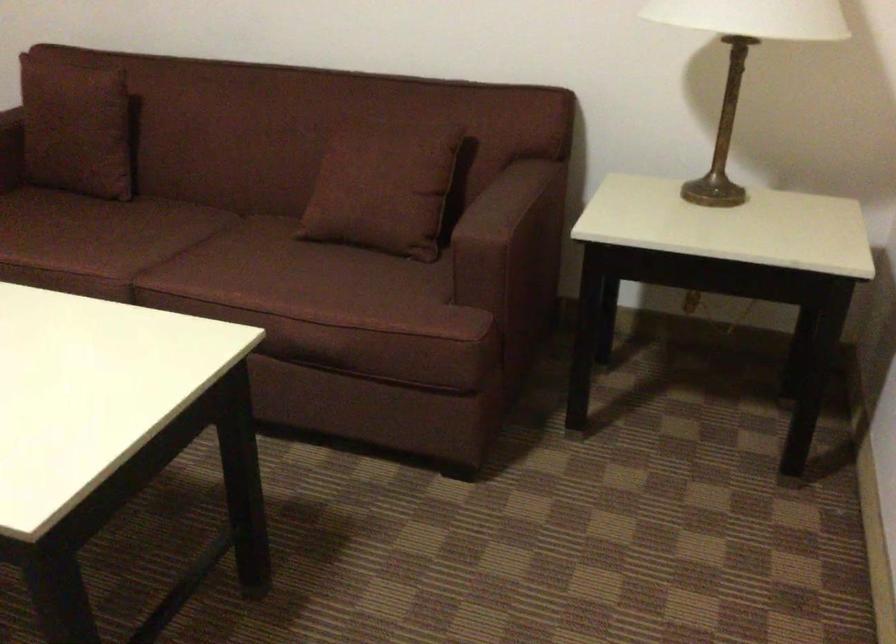
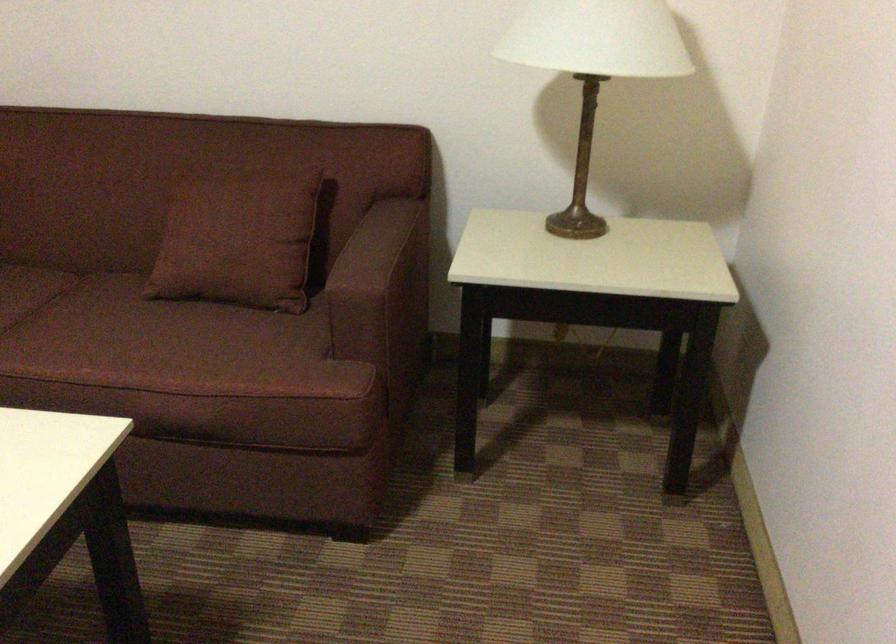
The point at (x=381, y=182) is marked in the first image. Where is the corresponding point in the second image?

(238, 234)